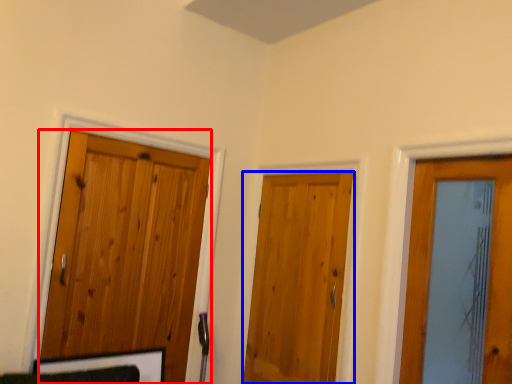
Question: Which object appears farthest to the camera in this image, door (highlighted by a red box) or door (highlighted by a blue box)?

Choices:
 (A) door
 (B) door

Answer: (B)